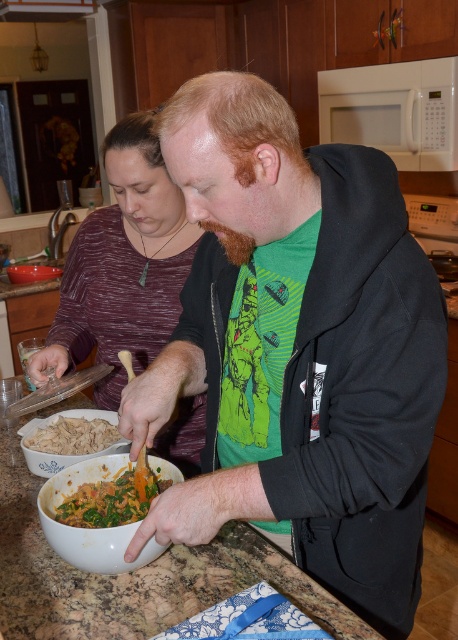
Question: Does white shredded meat at lower left come behind white matte bowl at lower left?

Choices:
 (A) yes
 (B) no

Answer: (B)

Question: Which of the following is the farthest from the observer?

Choices:
 (A) (321, 88)
 (B) (361, 628)

Answer: (A)

Question: Considering the real-world distances, which object is closest to the green matte shirt at center?

Choices:
 (A) marble countertop at center
 (B) white matte microwave at upper center
 (C) matte white bowl at center
 (D) white matte bowl at lower left

Answer: (C)

Question: Which object is the farthest from the white matte microwave at upper center?

Choices:
 (A) maroon sweater at center
 (B) marble countertop at center
 (C) white matte bowl at lower left
 (D) chopped green vegetables at center

Answer: (D)

Question: Is marble countertop at center positioned behind white matte bowl at lower left?

Choices:
 (A) yes
 (B) no

Answer: (B)

Question: Can you confirm if green matte shirt at center is thinner than chopped green vegetables at center?

Choices:
 (A) yes
 (B) no

Answer: (B)